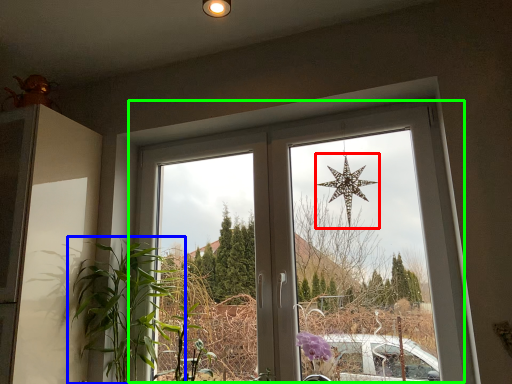
Question: Which is farther away from star (highlighted by a red box)? houseplant (highlighted by a blue box) or window (highlighted by a green box)?

Choices:
 (A) houseplant
 (B) window

Answer: (A)